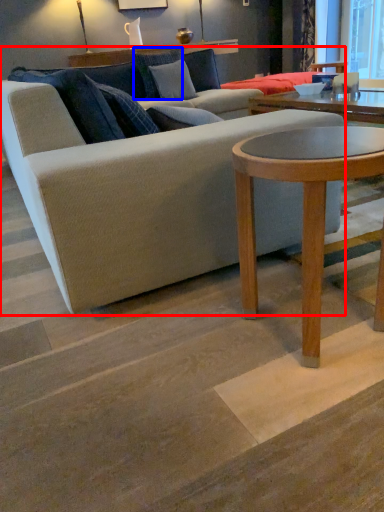
Question: Which object is further to the camera taking this photo, studio couch (highlighted by a red box) or pillow (highlighted by a blue box)?

Choices:
 (A) studio couch
 (B) pillow

Answer: (B)